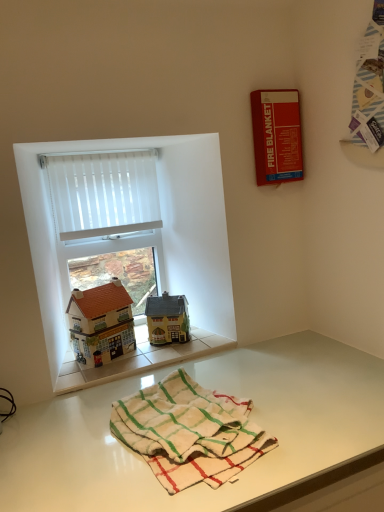
Question: Considering the relative positions of white sheer curtain at upper left and white vertical blinds at upper left in the image provided, is white sheer curtain at upper left in front of white vertical blinds at upper left?

Choices:
 (A) no
 (B) yes

Answer: (B)

Question: Could white vertical blinds at upper left be considered to be inside white sheer curtain at upper left?

Choices:
 (A) no
 (B) yes

Answer: (A)

Question: Is white sheer curtain at upper left facing away from white vertical blinds at upper left?

Choices:
 (A) yes
 (B) no

Answer: (A)

Question: Considering the relative sizes of white sheer curtain at upper left and white vertical blinds at upper left in the image provided, is white sheer curtain at upper left thinner than white vertical blinds at upper left?

Choices:
 (A) no
 (B) yes

Answer: (B)

Question: Could you tell me if white sheer curtain at upper left is turned towards white vertical blinds at upper left?

Choices:
 (A) no
 (B) yes

Answer: (B)

Question: Does point (168, 322) appear closer or farther from the camera than point (322, 342)?

Choices:
 (A) closer
 (B) farther

Answer: (B)

Question: In the image, is matte yellow house at center, the 2th toy positioned from the left, on the left side or the right side of white glossy table at lower center?

Choices:
 (A) left
 (B) right

Answer: (A)

Question: Is matte yellow house at center, which ranks as the first toy in right-to-left order, bigger or smaller than white glossy table at lower center?

Choices:
 (A) big
 (B) small

Answer: (B)

Question: Is matte yellow house at center, which ranks as the first toy in right-to-left order, in front of or behind white glossy table at lower center in the image?

Choices:
 (A) behind
 (B) front

Answer: (A)

Question: Does point (49, 481) appear closer or farther from the camera than point (69, 212)?

Choices:
 (A) closer
 (B) farther

Answer: (A)

Question: In terms of size, does white glossy table at lower center appear bigger or smaller than white sheer curtain at upper left?

Choices:
 (A) big
 (B) small

Answer: (A)

Question: Visually, is white glossy table at lower center positioned to the left or to the right of white sheer curtain at upper left?

Choices:
 (A) left
 (B) right

Answer: (B)

Question: From a real-world perspective, relative to white sheer curtain at upper left, is white glossy table at lower center vertically above or below?

Choices:
 (A) above
 (B) below

Answer: (B)

Question: From a real-world perspective, relative to white cotton bath towel at lower center, is white glossy table at lower center vertically above or below?

Choices:
 (A) above
 (B) below

Answer: (B)

Question: From the image's perspective, is white glossy table at lower center located above or below white cotton bath towel at lower center?

Choices:
 (A) below
 (B) above

Answer: (A)